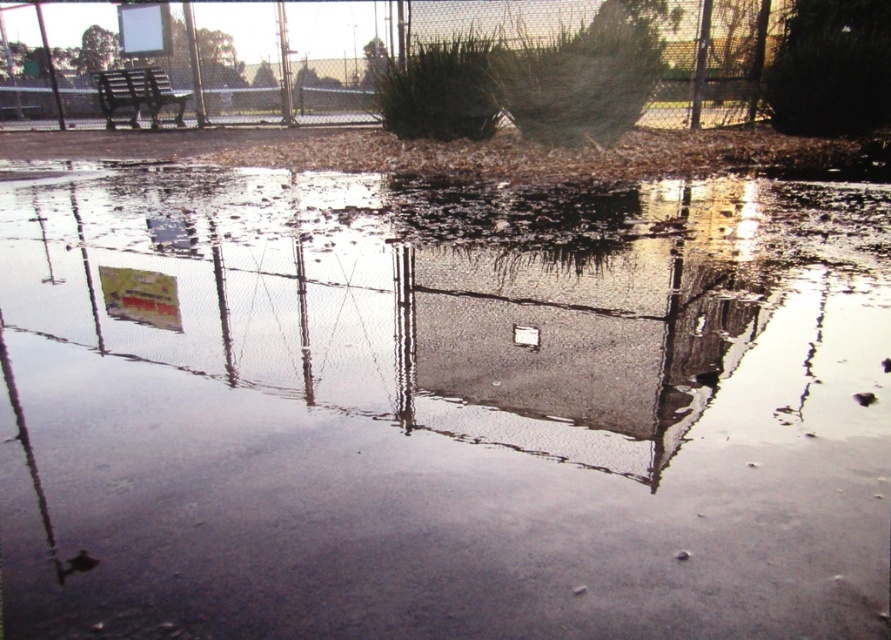
Question: Observing the image, what is the correct spatial positioning of metallic chain-link fence at upper center in reference to metallic park bench at upper left?

Choices:
 (A) left
 (B) right

Answer: (B)

Question: Which object appears farthest from the camera in this image?

Choices:
 (A) metallic park bench at upper left
 (B) metallic chain-link fence at upper center

Answer: (A)

Question: Does metallic chain-link fence at upper center have a greater width compared to metallic park bench at upper left?

Choices:
 (A) no
 (B) yes

Answer: (B)

Question: Can you confirm if metallic chain-link fence at upper center is positioned to the right of metallic park bench at upper left?

Choices:
 (A) no
 (B) yes

Answer: (B)

Question: Which object appears farthest from the camera in this image?

Choices:
 (A) metallic chain-link fence at upper center
 (B) metallic park bench at upper left

Answer: (B)

Question: Which of the following is the closest to the observer?

Choices:
 (A) (734, 28)
 (B) (105, 76)

Answer: (A)